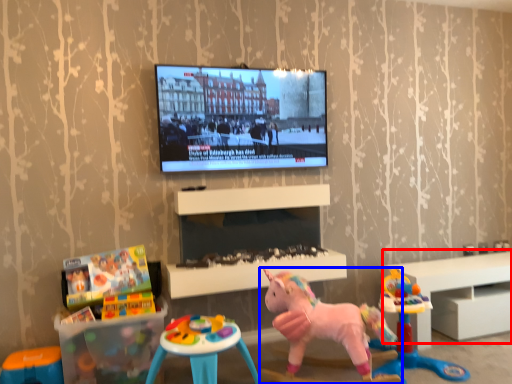
Question: Which of the following is the closest to the observer, furniture (highlighted by a red box) or toy (highlighted by a blue box)?

Choices:
 (A) furniture
 (B) toy

Answer: (B)